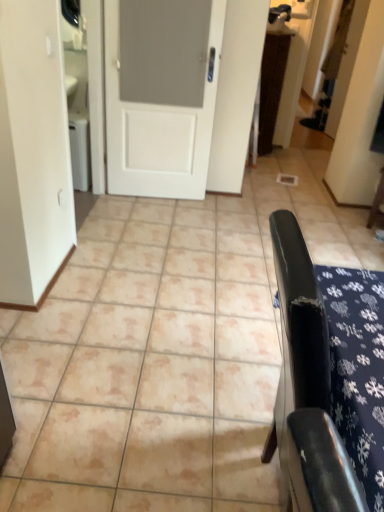
The image size is (384, 512). What do you see at coordinates (272, 84) in the screenshot?
I see `brown textured rug at upper center` at bounding box center [272, 84].

Image resolution: width=384 pixels, height=512 pixels. In order to click on wooden chair at right, positioned as the second furniture in bottom-to-top order in this screenshot , I will do `click(377, 204)`.

This screenshot has width=384, height=512. What do you see at coordinates (306, 387) in the screenshot? I see `black leather chair at right, the 1th furniture positioned from the front` at bounding box center [306, 387].

The width and height of the screenshot is (384, 512). Identify the location of beige ceramic tile at center. (147, 367).

Which object is positioned more to the left, white matte door at center or brown textured rug at upper center?

white matte door at center is more to the left.

Measure the distance between white matte door at center and brown textured rug at upper center.

white matte door at center is 1.61 meters from brown textured rug at upper center.

How different are the orientations of white matte door at center and brown textured rug at upper center in degrees?

43 degrees.

From the picture: Which of these two, white matte door at center or brown textured rug at upper center, is wider?

With larger width is brown textured rug at upper center.

Would you say brown textured rug at upper center is inside or outside white matte door at center?

brown textured rug at upper center exists outside the volume of white matte door at center.

Which object is wider, brown textured rug at upper center or white matte door at center?

With larger width is brown textured rug at upper center.

Is brown textured rug at upper center touching white matte door at center?

No.

How different are the orientations of brown textured rug at upper center and white matte door at center in degrees?

There is a 43-degree angle between the facing directions of brown textured rug at upper center and white matte door at center.

Is white matte door at center aimed at black leather chair at right, which appears as the 2th furniture when viewed from the back?

Yes, white matte door at center is facing black leather chair at right, which appears as the 2th furniture when viewed from the back.

From the image's perspective, between white matte door at center and black leather chair at right, positioned as the 1th furniture in left-to-right order, which one is located above?

white matte door at center, from the image's perspective.

Between white matte door at center and black leather chair at right, acting as the 2th furniture starting from the right, which one has larger width?

With larger width is black leather chair at right, acting as the 2th furniture starting from the right.

Is white matte door at center far away from black leather chair at right, acting as the 2th furniture starting from the right?

Indeed, white matte door at center is not near black leather chair at right, acting as the 2th furniture starting from the right.

Which of these two, beige ceramic tile at center or black leather chair at right, the second furniture from the top, is bigger?

beige ceramic tile at center is bigger.

Which object is closer to the camera taking this photo, beige ceramic tile at center or black leather chair at right, positioned as the 1th furniture in left-to-right order?

black leather chair at right, positioned as the 1th furniture in left-to-right order, is in front.

From the image's perspective, relative to black leather chair at right, the 1th furniture positioned from the front, is beige ceramic tile at center above or below?

Based on their image positions, beige ceramic tile at center is located above black leather chair at right, the 1th furniture positioned from the front.

From a real-world perspective, is beige ceramic tile at center physically located above or below black leather chair at right, the second furniture from the top?

From a real-world perspective, beige ceramic tile at center is physically below black leather chair at right, the second furniture from the top.

Identify the location of furniture below the wooden chair at right, which appears as the second furniture when viewed from the left (from the image's perspective). (306, 387).

Is black leather chair at right, which appears as the 2th furniture when viewed from the back, not within wooden chair at right, which is counted as the 1th furniture, starting from the right?

Yes.

Is black leather chair at right, the second furniture from the top, taller or shorter than wooden chair at right, the second furniture in the front-to-back sequence?

In the image, black leather chair at right, the second furniture from the top, appears to be taller than wooden chair at right, the second furniture in the front-to-back sequence.

Based on the photo, can you confirm if black leather chair at right, the 1th furniture positioned from the front, is smaller than brown textured rug at upper center?

No.

Can you see black leather chair at right, the second furniture from the top, touching brown textured rug at upper center?

No, black leather chair at right, the second furniture from the top, is not next to brown textured rug at upper center.

Is brown textured rug at upper center located within black leather chair at right, acting as the 2th furniture starting from the right?

No, brown textured rug at upper center is not surrounded by black leather chair at right, acting as the 2th furniture starting from the right.

Consider the image. From the image's perspective, does black leather chair at right, the first furniture when ordered from bottom to top, appear lower than brown textured rug at upper center?

Yes, from the image's perspective, black leather chair at right, the first furniture when ordered from bottom to top, is beneath brown textured rug at upper center.

Which is behind, wooden chair at right, which appears as the second furniture when viewed from the left, or white matte door at center?

wooden chair at right, which appears as the second furniture when viewed from the left.

From a real-world perspective, who is located lower, wooden chair at right, positioned as the second furniture in bottom-to-top order, or white matte door at center?

wooden chair at right, positioned as the second furniture in bottom-to-top order, from a real-world perspective.

Which object is positioned more to the left, wooden chair at right, positioned as the second furniture in bottom-to-top order, or white matte door at center?

Positioned to the left is white matte door at center.

From the image's perspective, is wooden chair at right, positioned as the second furniture in bottom-to-top order, on white matte door at center?

Actually, wooden chair at right, positioned as the second furniture in bottom-to-top order, appears below white matte door at center in the image.

In the image, there is a white matte door at center. Where is `table below it (from a real-world perspective)`? This screenshot has height=512, width=384. table below it (from a real-world perspective) is located at coordinates (272, 84).

Where is `table on the right of white matte door at center`? The width and height of the screenshot is (384, 512). table on the right of white matte door at center is located at coordinates (272, 84).

From the image, which object appears to be nearer to wooden chair at right, positioned as the 1th furniture in top-to-bottom order, beige ceramic tile at center or brown textured rug at upper center?

brown textured rug at upper center is closer to wooden chair at right, positioned as the 1th furniture in top-to-bottom order.

Based on the photo, estimate the real-world distances between objects in this image. Which object is further from black leather chair at right, which appears as the 2th furniture when viewed from the back, brown textured rug at upper center or white matte door at center?

The object further to black leather chair at right, which appears as the 2th furniture when viewed from the back, is brown textured rug at upper center.

Considering their positions, is brown textured rug at upper center positioned closer to white matte door at center than black leather chair at right, the 1th furniture positioned from the front?

Based on the image, brown textured rug at upper center appears to be nearer to white matte door at center.

Estimate the real-world distances between objects in this image. Which object is further from brown textured rug at upper center, beige ceramic tile at center or white matte door at center?

beige ceramic tile at center is positioned further to the anchor brown textured rug at upper center.

Considering their positions, is white matte door at center positioned closer to brown textured rug at upper center than wooden chair at right, positioned as the second furniture in bottom-to-top order?

The object closer to brown textured rug at upper center is white matte door at center.

Which object lies nearer to the anchor point black leather chair at right, the first furniture when ordered from bottom to top, beige ceramic tile at center or white matte door at center?

Based on the image, beige ceramic tile at center appears to be nearer to black leather chair at right, the first furniture when ordered from bottom to top.

Looking at the image, which one is located closer to beige ceramic tile at center, brown textured rug at upper center or wooden chair at right, which appears as the second furniture when viewed from the left?

wooden chair at right, which appears as the second furniture when viewed from the left, is positioned closer to the anchor beige ceramic tile at center.

Which object lies nearer to the anchor point brown textured rug at upper center, beige ceramic tile at center or black leather chair at right, acting as the 2th furniture starting from the right?

Based on the image, beige ceramic tile at center appears to be nearer to brown textured rug at upper center.

At what (x,y) coordinates should I click in order to perform the action: click on furniture positioned between black leather chair at right, acting as the 2th furniture starting from the right, and brown textured rug at upper center from near to far. Please return your answer as a coordinate pair (x, y). The image size is (384, 512). Looking at the image, I should click on (377, 204).

Image resolution: width=384 pixels, height=512 pixels. What are the coordinates of `door between black leather chair at right, which appears as the 2th furniture when viewed from the back, and brown textured rug at upper center from front to back` in the screenshot? It's located at (161, 94).

This screenshot has width=384, height=512. Identify the location of door between black leather chair at right, the second furniture from the top, and wooden chair at right, positioned as the second furniture in bottom-to-top order, from front to back. (161, 94).

Locate an element on the screen. ceramic tile between black leather chair at right, the second furniture from the top, and brown textured rug at upper center from front to back is located at coordinates (147, 367).